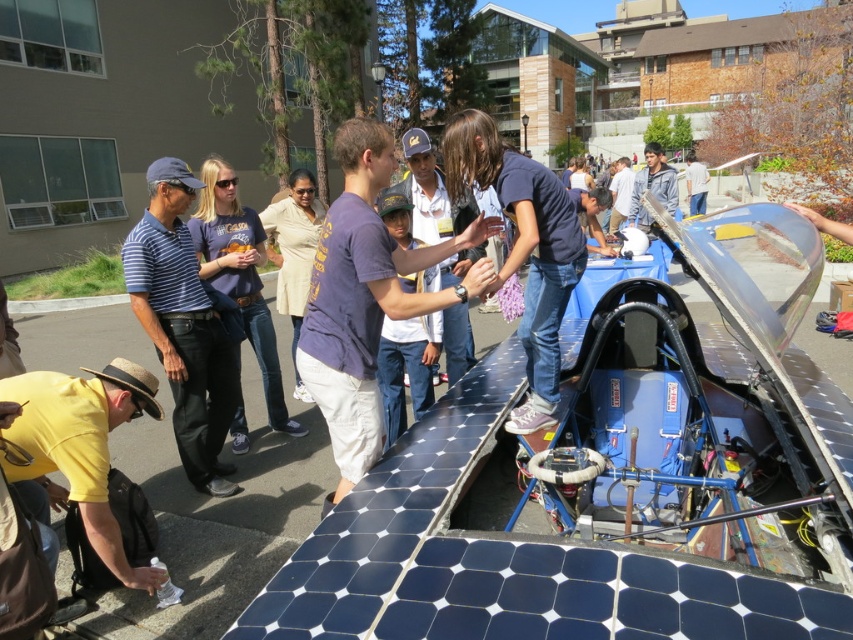
Question: Can you confirm if purple cotton shirt at center is thinner than blue striped shirt at left?

Choices:
 (A) yes
 (B) no

Answer: (B)

Question: Can you confirm if purple cotton shirt at center is positioned below blue striped shirt at left?

Choices:
 (A) no
 (B) yes

Answer: (A)

Question: Which of the following is the farthest from the observer?

Choices:
 (A) blue striped shirt at left
 (B) purple cotton shirt at center

Answer: (A)

Question: Which point is closer to the camera?

Choices:
 (A) (123, 273)
 (B) (370, 362)

Answer: (B)

Question: Is purple cotton shirt at center to the left of blue striped shirt at left from the viewer's perspective?

Choices:
 (A) no
 (B) yes

Answer: (A)